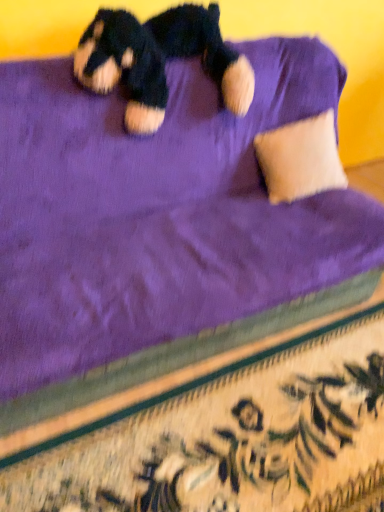
This screenshot has height=512, width=384. I want to click on soft plush teddy bear at upper center, so coord(159,60).

The width and height of the screenshot is (384, 512). What do you see at coordinates (159, 60) in the screenshot?
I see `soft plush teddy bear at upper center` at bounding box center [159, 60].

Locate an element on the screen. beige soft pillow at upper right is located at coordinates (300, 159).

What do you see at coordinates (300, 159) in the screenshot?
I see `beige soft pillow at upper right` at bounding box center [300, 159].

Where is `soft plush teddy bear at upper center`? soft plush teddy bear at upper center is located at coordinates (159, 60).

Consider the image. Considering the relative positions of soft plush teddy bear at upper center and beige soft pillow at upper right in the image provided, is soft plush teddy bear at upper center to the left of beige soft pillow at upper right from the viewer's perspective?

Yes.

Which object is further away from the camera, soft plush teddy bear at upper center or beige soft pillow at upper right?

beige soft pillow at upper right is behind.

Considering the points (107, 36) and (309, 157), which point is in front, point (107, 36) or point (309, 157)?

The point (107, 36) is in front.

From the image's perspective, which is below, soft plush teddy bear at upper center or beige soft pillow at upper right?

beige soft pillow at upper right.

From a real-world perspective, is soft plush teddy bear at upper center above or below beige soft pillow at upper right?

soft plush teddy bear at upper center is above beige soft pillow at upper right.

Which object is wider, soft plush teddy bear at upper center or beige soft pillow at upper right?

soft plush teddy bear at upper center.

Who is shorter, soft plush teddy bear at upper center or beige soft pillow at upper right?

Standing shorter between the two is beige soft pillow at upper right.

Does soft plush teddy bear at upper center have a larger size compared to beige soft pillow at upper right?

Yes.

Is beige soft pillow at upper right located within soft plush teddy bear at upper center?

No, beige soft pillow at upper right is located outside of soft plush teddy bear at upper center.

Is the surface of soft plush teddy bear at upper center in direct contact with beige soft pillow at upper right?

They are not placed beside each other.

Is soft plush teddy bear at upper center looking in the opposite direction of beige soft pillow at upper right?

No, soft plush teddy bear at upper center is not facing away from beige soft pillow at upper right.

Locate an element on the screen. pillow on the right of soft plush teddy bear at upper center is located at coordinates (300, 159).

Visually, is beige soft pillow at upper right positioned to the left or to the right of soft plush teddy bear at upper center?

Clearly, beige soft pillow at upper right is on the right of soft plush teddy bear at upper center in the image.

Does beige soft pillow at upper right lie behind soft plush teddy bear at upper center?

Yes, the depth of beige soft pillow at upper right is greater than that of soft plush teddy bear at upper center.

Is point (288, 173) farther from camera compared to point (119, 22)?

Yes, it is.

From the image's perspective, which is below, beige soft pillow at upper right or soft plush teddy bear at upper center?

beige soft pillow at upper right, from the image's perspective.

From a real-world perspective, between beige soft pillow at upper right and soft plush teddy bear at upper center, who is vertically lower?

beige soft pillow at upper right.

Which object is thinner, beige soft pillow at upper right or soft plush teddy bear at upper center?

beige soft pillow at upper right is thinner.

Does beige soft pillow at upper right have a lesser height compared to soft plush teddy bear at upper center?

Indeed, beige soft pillow at upper right has a lesser height compared to soft plush teddy bear at upper center.

Between beige soft pillow at upper right and soft plush teddy bear at upper center, which one has larger size?

soft plush teddy bear at upper center.

Is beige soft pillow at upper right completely or partially outside of soft plush teddy bear at upper center?

Yes, beige soft pillow at upper right is not within soft plush teddy bear at upper center.

Is beige soft pillow at upper right touching soft plush teddy bear at upper center?

beige soft pillow at upper right and soft plush teddy bear at upper center are clearly separated.

Could you tell me if beige soft pillow at upper right is turned towards soft plush teddy bear at upper center?

No, beige soft pillow at upper right is not aimed at soft plush teddy bear at upper center.

Can you tell me how much beige soft pillow at upper right and soft plush teddy bear at upper center differ in facing direction?

The facing directions of beige soft pillow at upper right and soft plush teddy bear at upper center are 0.00137 degrees apart.

This screenshot has width=384, height=512. I want to click on pillow below the soft plush teddy bear at upper center (from a real-world perspective), so click(300, 159).

Identify the location of pillow behind the soft plush teddy bear at upper center. (300, 159).

Identify the location of pillow that appears below the soft plush teddy bear at upper center (from the image's perspective). (300, 159).